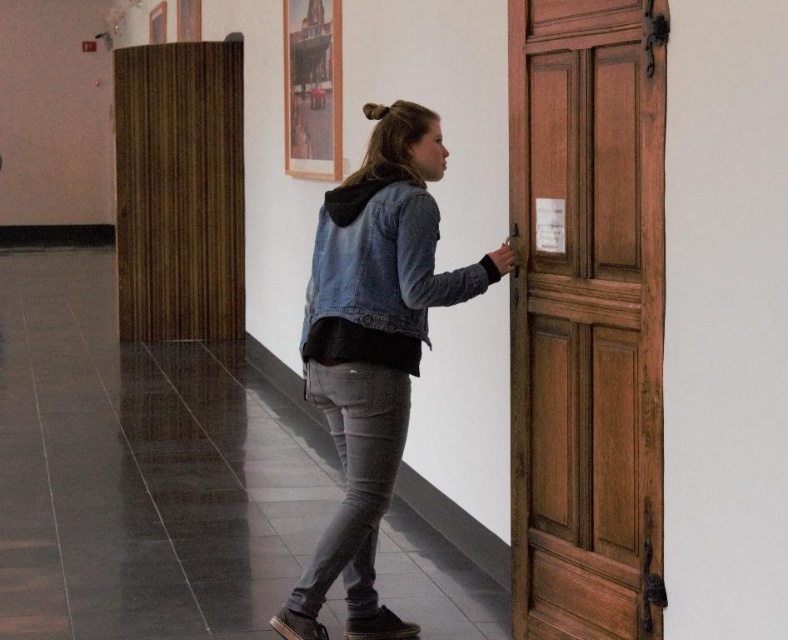
Between wooden panelled door at right and denim jacket at center, which one is positioned higher?

Positioned higher is wooden panelled door at right.

Can you confirm if wooden panelled door at right is taller than denim jacket at center?

Yes.

Between point (615, 348) and point (417, 308), which one is positioned behind?

Point (417, 308)

Locate an element on the screen. The image size is (788, 640). wooden panelled door at right is located at coordinates (586, 316).